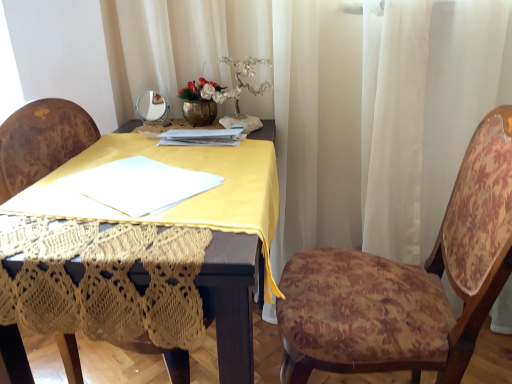
Question: Does floral fabric chair at right, the 2th chair positioned from the left, have a greater width compared to velvet floral chair at center, positioned as the 1th chair in left-to-right order?

Choices:
 (A) yes
 (B) no

Answer: (B)

Question: Can you confirm if floral fabric chair at right, the 2th chair positioned from the left, is thinner than velvet floral chair at center, positioned as the 1th chair in left-to-right order?

Choices:
 (A) yes
 (B) no

Answer: (A)

Question: Would you say floral fabric chair at right, which is the 1th chair from right to left, is outside velvet floral chair at center, positioned as the 1th chair in left-to-right order?

Choices:
 (A) no
 (B) yes

Answer: (B)

Question: Is floral fabric chair at right, the 2th chair positioned from the left, smaller than velvet floral chair at center, arranged as the 2th chair when viewed from the right?

Choices:
 (A) no
 (B) yes

Answer: (A)

Question: Considering the relative positions of floral fabric chair at right, which is the 1th chair from right to left, and velvet floral chair at center, positioned as the 1th chair in left-to-right order, in the image provided, is floral fabric chair at right, which is the 1th chair from right to left, to the left of velvet floral chair at center, positioned as the 1th chair in left-to-right order, from the viewer's perspective?

Choices:
 (A) yes
 (B) no

Answer: (B)

Question: From the image's perspective, is floral fabric chair at right, which is the 1th chair from right to left, on velvet floral chair at center, positioned as the 1th chair in left-to-right order?

Choices:
 (A) no
 (B) yes

Answer: (A)

Question: Is velvet floral chair at center, arranged as the 2th chair when viewed from the right, directly adjacent to floral fabric chair at right, which is the 1th chair from right to left?

Choices:
 (A) yes
 (B) no

Answer: (B)

Question: From the image's perspective, is velvet floral chair at center, arranged as the 2th chair when viewed from the right, located above floral fabric chair at right, which is the 1th chair from right to left?

Choices:
 (A) yes
 (B) no

Answer: (A)

Question: Does velvet floral chair at center, arranged as the 2th chair when viewed from the right, appear on the left side of floral fabric chair at right, which is the 1th chair from right to left?

Choices:
 (A) no
 (B) yes

Answer: (B)

Question: Is velvet floral chair at center, positioned as the 1th chair in left-to-right order, positioned behind floral fabric chair at right, the 2th chair positioned from the left?

Choices:
 (A) yes
 (B) no

Answer: (A)

Question: Is velvet floral chair at center, positioned as the 1th chair in left-to-right order, shorter than floral fabric chair at right, which is the 1th chair from right to left?

Choices:
 (A) no
 (B) yes

Answer: (A)

Question: Is velvet floral chair at center, arranged as the 2th chair when viewed from the right, far from white sheer curtain at upper center?

Choices:
 (A) no
 (B) yes

Answer: (A)